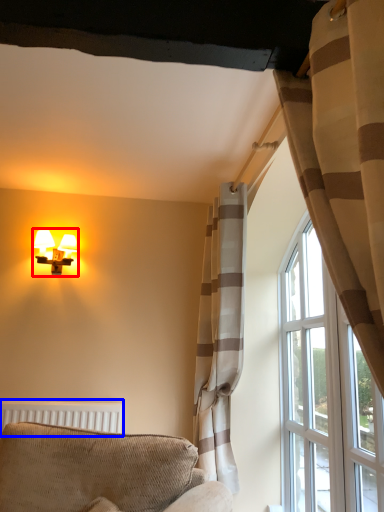
Question: Which object is closer to the camera taking this photo, lamp (highlighted by a red box) or radiator (highlighted by a blue box)?

Choices:
 (A) lamp
 (B) radiator

Answer: (B)